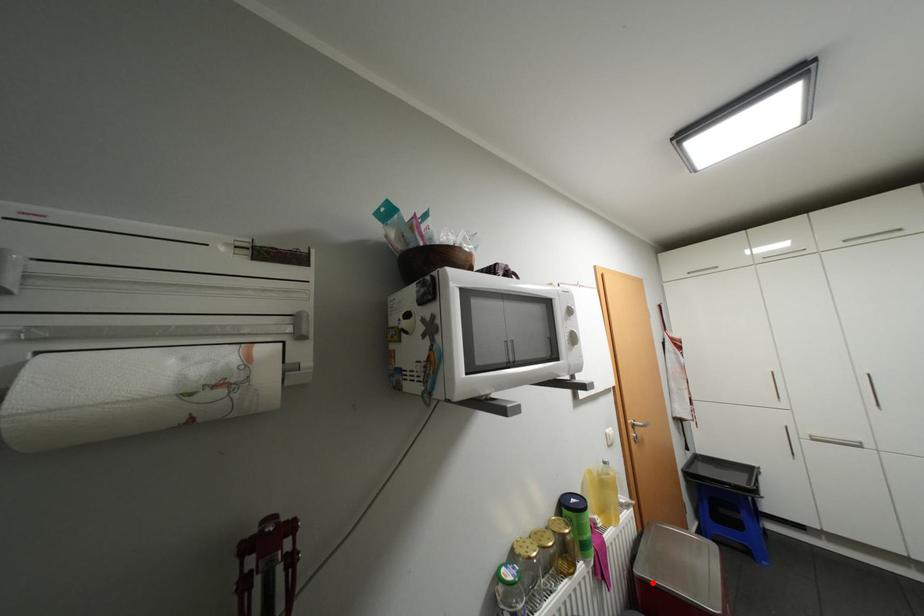
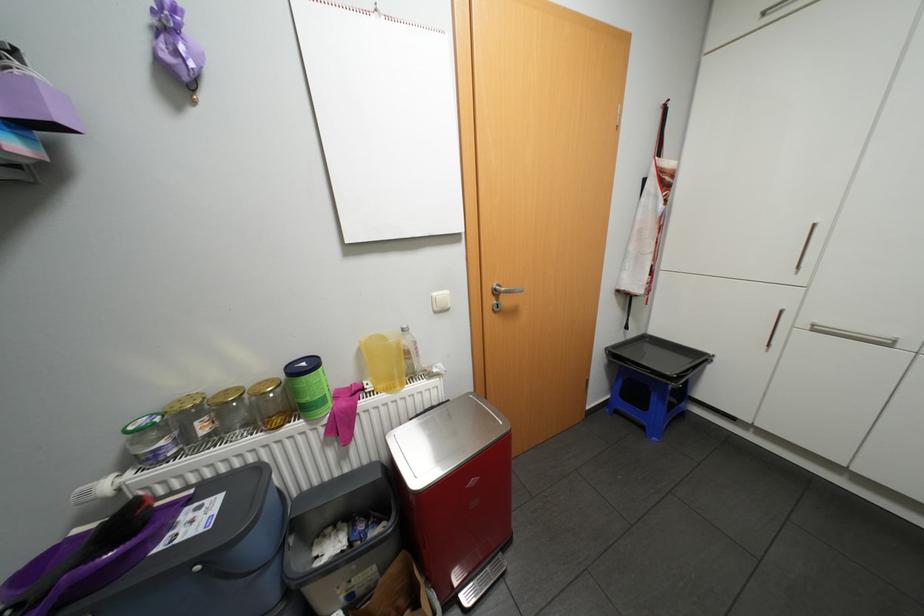
In the second image, find the point that corresponds to the highlighted location in the first image.

(395, 446)